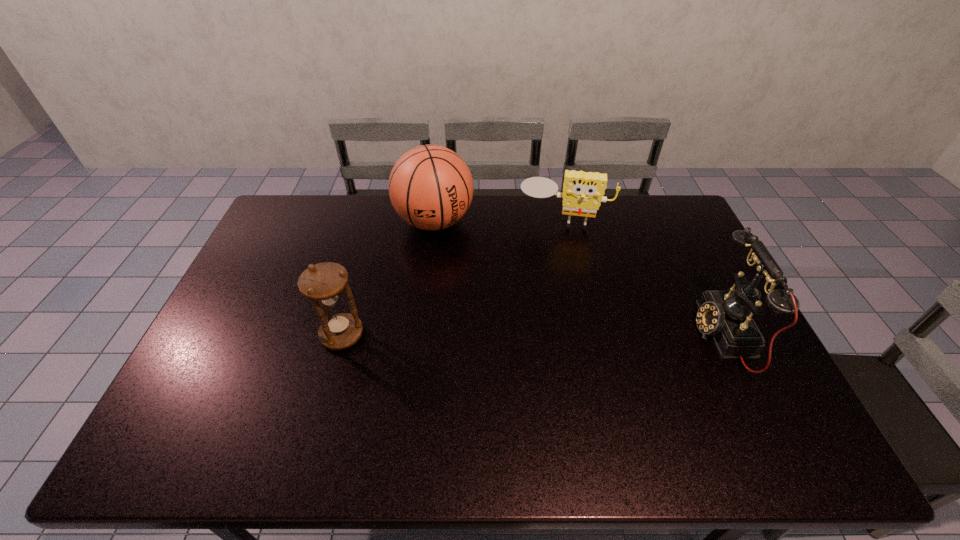
Locate an element on the screen. This screenshot has width=960, height=540. free space that satisfies the following two spatial constraints: 1. on the front side of the rightmost object; 2. on the dial of the third object from right to left is located at coordinates pyautogui.click(x=421, y=335).

Find the location of a particular element. vacant point that satisfies the following two spatial constraints: 1. on the back side of the third object from right to left; 2. on the left side of the sponge is located at coordinates (435, 221).

Identify the location of vacant region that satisfies the following two spatial constraints: 1. on the front side of the rightmost object; 2. on the dial of the basketball. This screenshot has width=960, height=540. (421, 335).